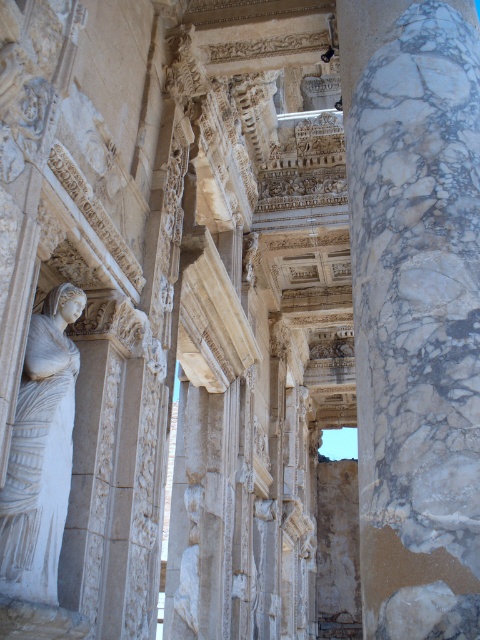
Which is behind, point (472, 38) or point (41, 388)?

The point (472, 38) is behind.

Does marble column at right have a larger size compared to white marble statue at left?

Indeed, marble column at right has a larger size compared to white marble statue at left.

Where is `marble column at right`? Image resolution: width=480 pixels, height=640 pixels. marble column at right is located at coordinates (415, 310).

Find the location of a particular element. The height and width of the screenshot is (640, 480). marble column at right is located at coordinates (415, 310).